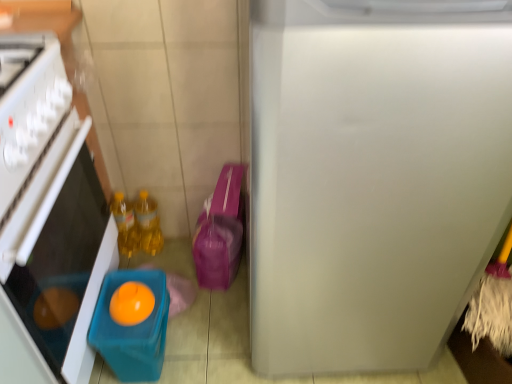
Question: Is there a large distance between matte plastic container at lower left and yellow translucent bottles at center, which is the 1th bottle in right-to-left order?

Choices:
 (A) no
 (B) yes

Answer: (A)

Question: Can you confirm if matte plastic container at lower left is thinner than yellow translucent bottles at center, which is the 1th bottle in right-to-left order?

Choices:
 (A) no
 (B) yes

Answer: (A)

Question: Is matte plastic container at lower left oriented towards yellow translucent bottles at center, which is the second bottle in left-to-right order?

Choices:
 (A) no
 (B) yes

Answer: (A)

Question: From the image's perspective, would you say matte plastic container at lower left is positioned over yellow translucent bottles at center, which is the 1th bottle in right-to-left order?

Choices:
 (A) yes
 (B) no

Answer: (B)

Question: Considering the relative sizes of matte plastic container at lower left and yellow translucent bottles at center, which is the 1th bottle in right-to-left order, in the image provided, is matte plastic container at lower left bigger than yellow translucent bottles at center, which is the 1th bottle in right-to-left order,?

Choices:
 (A) no
 (B) yes

Answer: (B)

Question: Is white matte refrigerator at right in front of or behind translucent plastic container at left in the image?

Choices:
 (A) front
 (B) behind

Answer: (A)

Question: In terms of width, does white matte refrigerator at right look wider or thinner when compared to translucent plastic container at left?

Choices:
 (A) thin
 (B) wide

Answer: (B)

Question: Considering the positions of point (266, 135) and point (70, 182), is point (266, 135) closer or farther from the camera than point (70, 182)?

Choices:
 (A) closer
 (B) farther

Answer: (A)

Question: In the image, is white matte refrigerator at right on the left side or the right side of translucent plastic container at left?

Choices:
 (A) right
 (B) left

Answer: (A)

Question: Is point (264, 327) positioned closer to the camera than point (133, 276)?

Choices:
 (A) closer
 (B) farther

Answer: (A)

Question: From a real-world perspective, is white matte refrigerator at right above or below matte plastic container at lower left?

Choices:
 (A) above
 (B) below

Answer: (A)

Question: From the image's perspective, is white matte refrigerator at right above or below matte plastic container at lower left?

Choices:
 (A) above
 (B) below

Answer: (A)

Question: Is white matte refrigerator at right inside the boundaries of matte plastic container at lower left, or outside?

Choices:
 (A) inside
 (B) outside

Answer: (B)

Question: Considering the positions of point click(59, 61) and point click(166, 317), is point click(59, 61) closer or farther from the camera than point click(166, 317)?

Choices:
 (A) farther
 (B) closer

Answer: (B)

Question: Is translucent plastic container at left inside the boundaries of matte plastic container at lower left, or outside?

Choices:
 (A) outside
 (B) inside

Answer: (A)